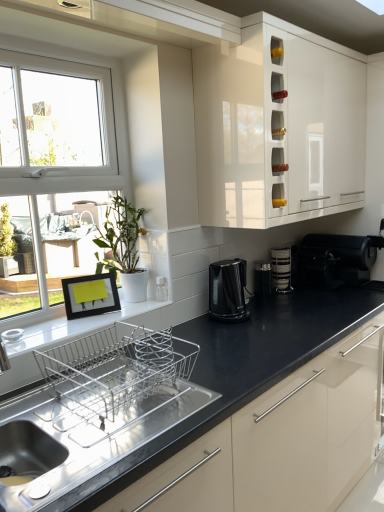
This screenshot has width=384, height=512. In order to click on vacant area that is in front of green leafy plant at left in this screenshot , I will do `click(115, 314)`.